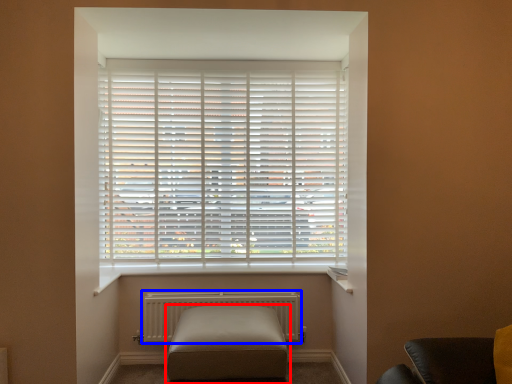
Question: Which of the following is the farthest to the observer, furniture (highlighted by a red box) or radiator (highlighted by a blue box)?

Choices:
 (A) furniture
 (B) radiator

Answer: (B)